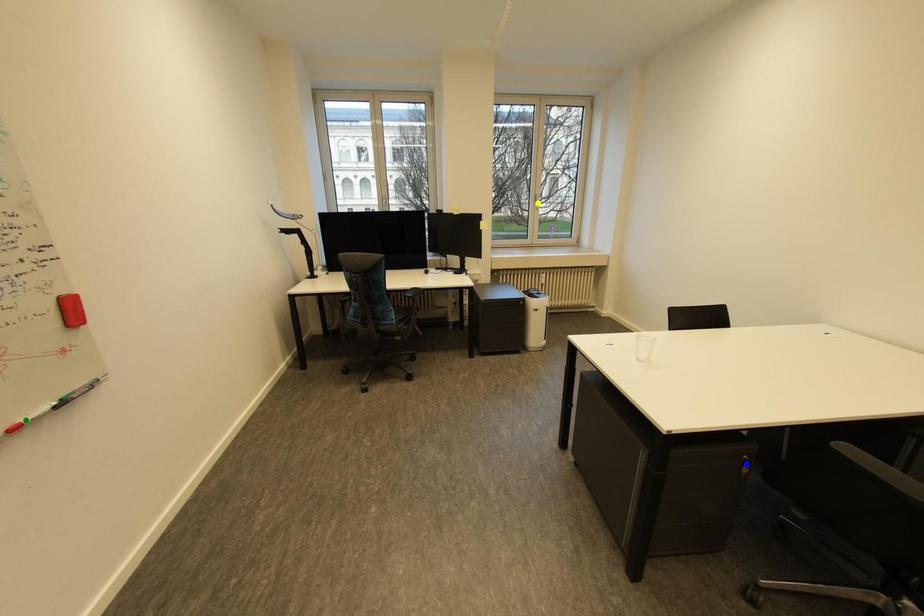
Order these from nearest to farthest:
A) blue point
B) green point
C) yellow point

yellow point < blue point < green point